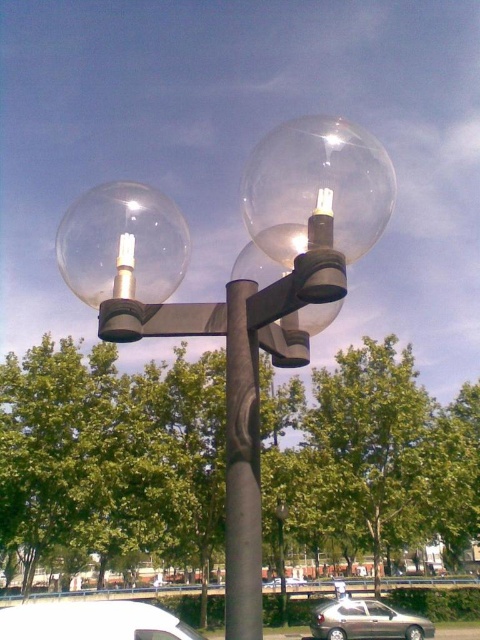
Measure the distance between black matte pole at center and silver metallic car at center.

33.93 meters

Who is more forward, (x=243, y=364) or (x=300, y=579)?

Point (x=243, y=364)

Identify the location of black matte pole at center. This screenshot has width=480, height=640. (x=241, y=470).

Locate an element on the screen. Image resolution: width=480 pixels, height=640 pixels. black matte pole at center is located at coordinates (241, 470).

Who is lower down, transparent glass globe at left or white matte van at lower left?

white matte van at lower left

Between transparent glass globe at left and white matte van at lower left, which one is positioned higher?

transparent glass globe at left is above.

Is point (149, 234) positioned before point (171, 632)?

Yes, point (149, 234) is closer to viewer.

Find the location of a particular element. Image resolution: width=480 pixels, height=640 pixels. transparent glass globe at left is located at coordinates (122, 244).

Between point (317, 182) and point (93, 269), which one is positioned behind?

Positioned behind is point (93, 269).

Is point (144, 236) closer to camera compared to point (143, 285)?

Yes, point (144, 236) is in front of point (143, 285).

Which is behind, point (118, 301) or point (179, 269)?

The point (179, 269) is more distant.

At what (x,y) coordinates should I click in order to perform the action: click on clear glass street light at center. Please return your answer as a coordinate pair (x, y). This screenshot has height=640, width=480. Looking at the image, I should click on click(239, 289).